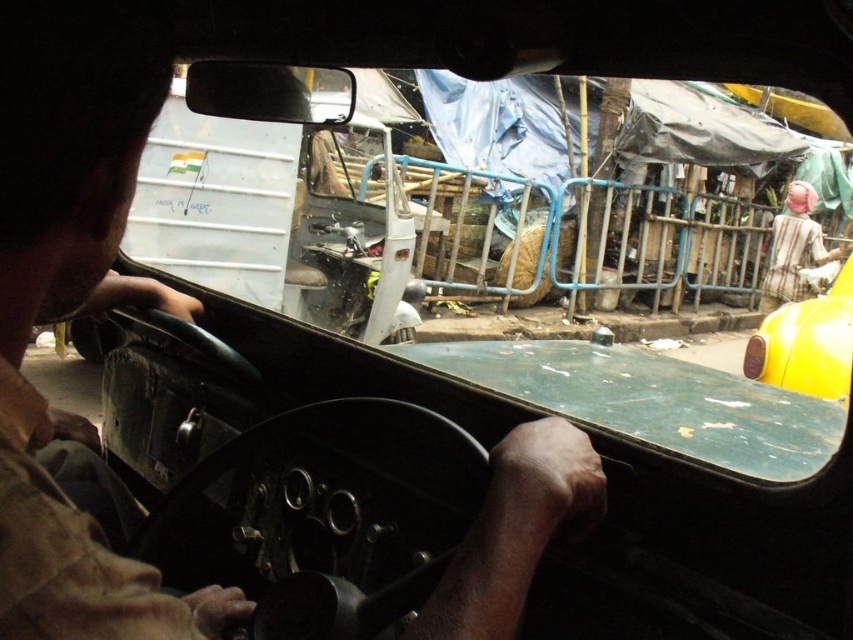
You are a passenger in the rickshaw and notice two items at the right side of your view. The yellow matte taxi at right and the striped fabric headscarf at right. Which one is closer to the center of your view?

The yellow matte taxi at right is to the left of striped fabric headscarf at right, so it is closer to the center of your view.

Based on the photo, you are a passenger in a rickshaw and want to know how far you are from the point marked at coordinates (820, 371). Can you determine the distance using the information provided?

The point marked at coordinates (820, 371) is 3.35 meters away from the camera, so you are 3.35 meters away from that point.

You are a passenger in the rickshaw and notice two items at the right side of the windshield. The items are the yellow matte taxi at right and the striped fabric headscarf at right. Which item is closer to the windshield?

The yellow matte taxi at right is shorter than the striped fabric headscarf at right, meaning the yellow matte taxi at right is closer to the windshield.